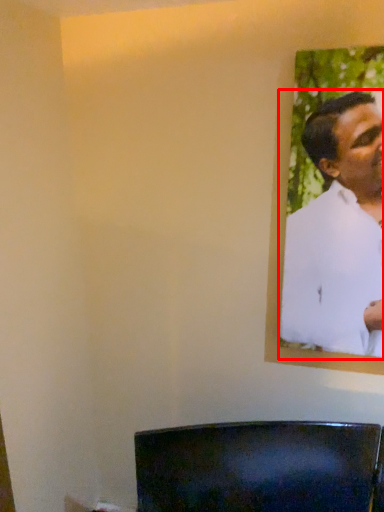
Question: From the image's perspective, what is the correct spatial positioning of man (annotated by the red box) in reference to furniture?

Choices:
 (A) above
 (B) below

Answer: (A)